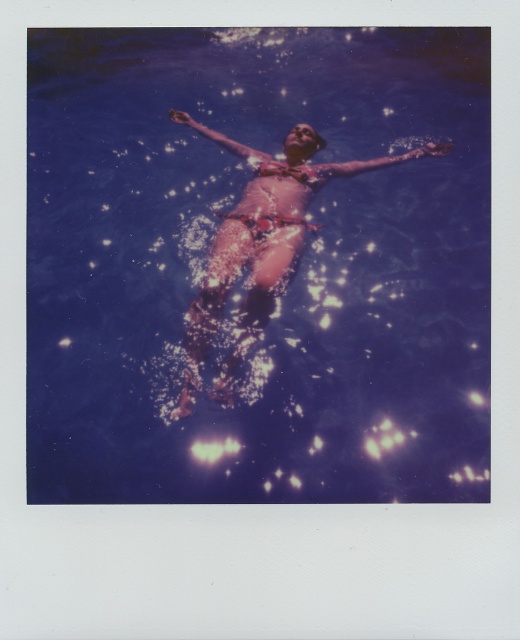
The image size is (520, 640). What do you see at coordinates (256, 266) in the screenshot?
I see `transparent blue water at center` at bounding box center [256, 266].

Does transparent blue water at center have a larger size compared to floral bikini at center?

Actually, transparent blue water at center might be smaller than floral bikini at center.

The width and height of the screenshot is (520, 640). I want to click on transparent blue water at center, so (x=256, y=266).

Where is `transparent blue water at center`? transparent blue water at center is located at coordinates (256, 266).